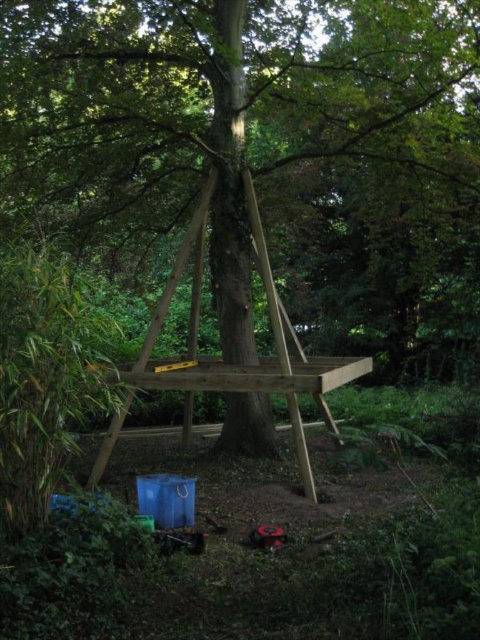
Who is higher up, natural wood tree at center or wooden picnic table at center?

natural wood tree at center

Between natural wood tree at center and wooden picnic table at center, which one is positioned lower?

wooden picnic table at center

Where is `natural wood tree at center`? natural wood tree at center is located at coordinates (254, 134).

Which is in front, point (46, 12) or point (210, 368)?

Point (46, 12) is in front.

Consider the image. Between natural wood tree at center and natural wood ladder at center, which one has less height?

natural wood ladder at center is shorter.

Between point (434, 76) and point (239, 371), which one is positioned in front?

Positioned in front is point (434, 76).

Where is `natural wood tree at center`? This screenshot has height=640, width=480. natural wood tree at center is located at coordinates (254, 134).

Can you confirm if natural wood ladder at center is positioned to the left of wooden picnic table at center?

Correct, you'll find natural wood ladder at center to the left of wooden picnic table at center.

Between point (289, 410) and point (188, 381), which one is positioned in front?

Positioned in front is point (289, 410).

What do you see at coordinates (257, 360) in the screenshot? I see `natural wood ladder at center` at bounding box center [257, 360].

The height and width of the screenshot is (640, 480). I want to click on natural wood ladder at center, so click(257, 360).